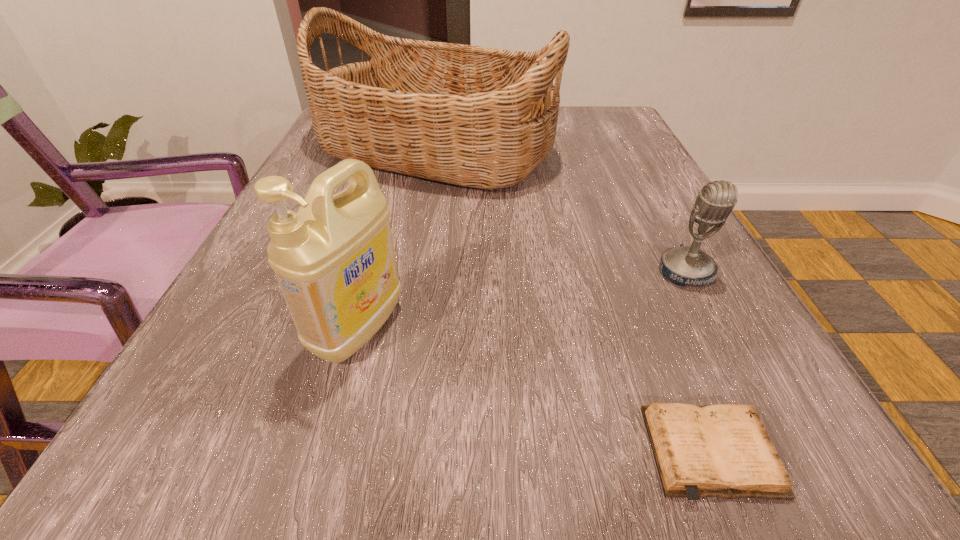
This screenshot has width=960, height=540. Identify the location of basket. (479, 117).

This screenshot has height=540, width=960. Find the location of `detergent`. detergent is located at coordinates (334, 259).

This screenshot has height=540, width=960. Find the location of `the third tallest object`. the third tallest object is located at coordinates (685, 265).

What are the coordinates of `diary` in the screenshot? It's located at (724, 450).

What are the coordinates of `the shortest object` in the screenshot? It's located at coord(724,450).

Locate an element on the screen. This screenshot has height=540, width=960. vacant area situated on the front of the farthest object is located at coordinates (424, 222).

Identify the location of vacant space located on the right of the detergent. (679, 328).

What are the coordinates of `free spot located 0.050m on the front-facing side of the second shortest object` in the screenshot? It's located at (708, 315).

Identify the location of vacant region located 0.190m on the left of the shortest object. Image resolution: width=960 pixels, height=540 pixels. click(474, 453).

The width and height of the screenshot is (960, 540). Identify the location of object present at the far edge. (479, 117).